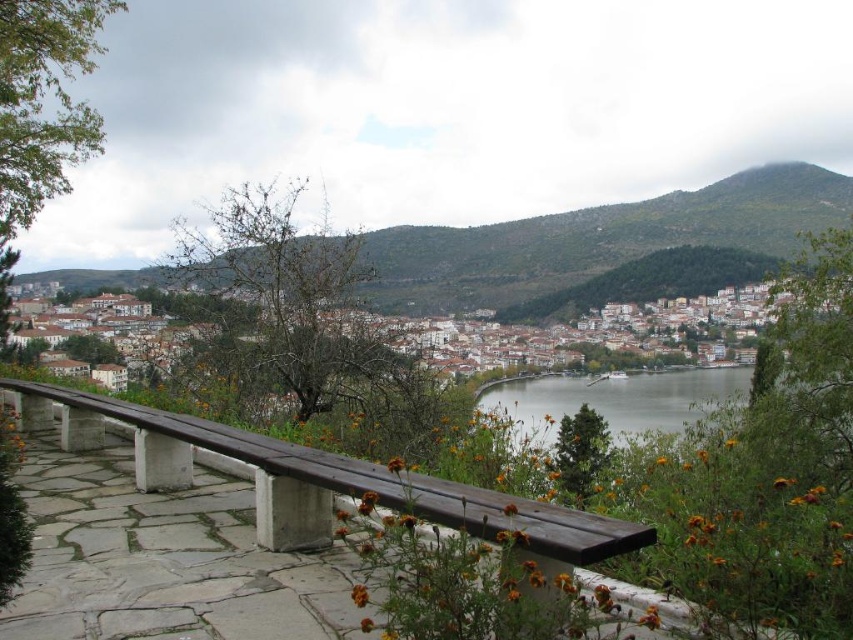
In the scene shown: You are planning to place a picnic blanket on the green grassy hillside at upper center and the brown wooden bench at center. Which location would allow you to spread the blanket more comfortably?

The green grassy hillside at upper center is bigger than the brown wooden bench at center, so it would allow you to spread the blanket more comfortably.

You are a tourist standing at the top of a hill overlooking the town. You want to sit on the brown wooden bench at center to take a photo of the clear water at center. Is the bench positioned in a way that allows you to see the water clearly from there?

The brown wooden bench at center is in front of clear water at center, so yes, the bench is positioned in front of the water, allowing you to see it clearly from there.

You are a tourist standing at the edge of the stone pathway and want to take a photo of the clear water at center while sitting on the brown wooden bench at center. Is the bench positioned to your left or right side of the water?

The brown wooden bench at center is positioned on the left side of clear water at center, so the bench is to your left side of the water.